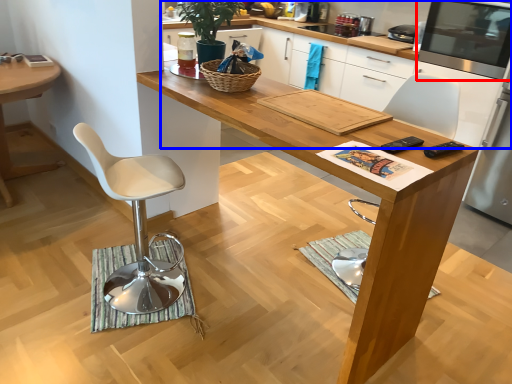
Question: Which object appears farthest to the camera in this image, appliance (highlighted by a red box) or cabinetry (highlighted by a blue box)?

Choices:
 (A) appliance
 (B) cabinetry

Answer: (B)